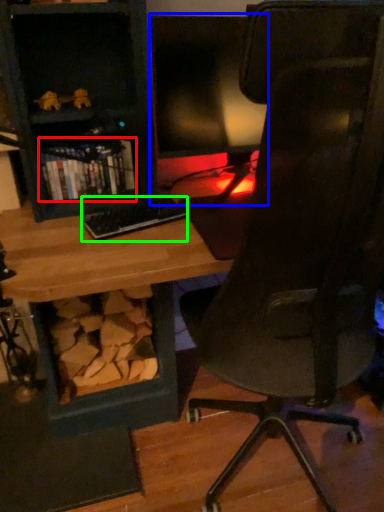
Question: Which object is the closest to the book (highlighted by a red box)? Choose among these: computer monitor (highlighted by a blue box) or keyboard (highlighted by a green box).

Choices:
 (A) computer monitor
 (B) keyboard

Answer: (B)